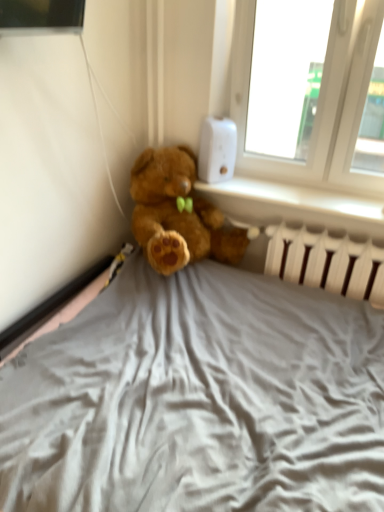
Question: Is white plastic thermostat at upper right shorter than white plastic radiator at lower right?

Choices:
 (A) no
 (B) yes

Answer: (A)

Question: Is white plastic thermostat at upper right bigger than white plastic radiator at lower right?

Choices:
 (A) yes
 (B) no

Answer: (B)

Question: Is white plastic thermostat at upper right at the left side of white plastic radiator at lower right?

Choices:
 (A) no
 (B) yes

Answer: (B)

Question: Is white plastic thermostat at upper right oriented towards white plastic radiator at lower right?

Choices:
 (A) yes
 (B) no

Answer: (B)

Question: Are white plastic thermostat at upper right and white plastic radiator at lower right located far from each other?

Choices:
 (A) yes
 (B) no

Answer: (B)

Question: Does point (215, 179) appear closer or farther from the camera than point (248, 203)?

Choices:
 (A) closer
 (B) farther

Answer: (A)

Question: Is white plastic thermostat at upper right wider or thinner than white plastic radiator at lower right?

Choices:
 (A) thin
 (B) wide

Answer: (A)

Question: Considering the relative positions of white plastic thermostat at upper right and white plastic radiator at lower right in the image provided, is white plastic thermostat at upper right to the left or to the right of white plastic radiator at lower right?

Choices:
 (A) left
 (B) right

Answer: (A)

Question: Relative to white plastic radiator at lower right, is white plastic thermostat at upper right in front or behind?

Choices:
 (A) behind
 (B) front

Answer: (A)

Question: In the image, is white plastic radiator at lower right positioned in front of or behind white plastic radiator at lower right?

Choices:
 (A) behind
 (B) front

Answer: (B)

Question: Is point (307, 260) positioned closer to the camera than point (311, 190)?

Choices:
 (A) farther
 (B) closer

Answer: (B)

Question: In terms of height, does white plastic radiator at lower right look taller or shorter compared to white plastic radiator at lower right?

Choices:
 (A) short
 (B) tall

Answer: (B)

Question: Based on their sizes in the image, would you say white plastic radiator at lower right is bigger or smaller than white plastic radiator at lower right?

Choices:
 (A) big
 (B) small

Answer: (A)

Question: Visually, is white plastic thermostat at upper right positioned to the left or to the right of white plastic radiator at lower right?

Choices:
 (A) right
 (B) left

Answer: (B)

Question: Considering their positions, is white plastic thermostat at upper right located in front of or behind white plastic radiator at lower right?

Choices:
 (A) front
 (B) behind

Answer: (B)